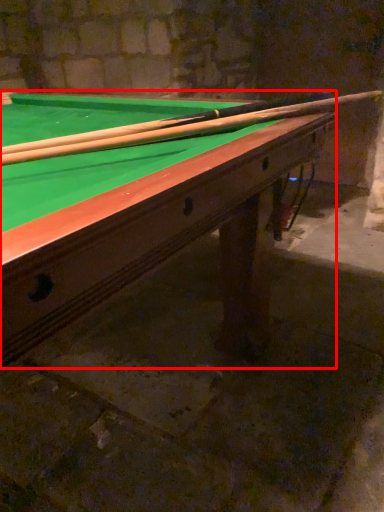
Question: From the image's perspective, considering the relative positions of billiard table (annotated by the red box) and cue in the image provided, where is billiard table (annotated by the red box) located with respect to the staircase?

Choices:
 (A) above
 (B) below

Answer: (B)